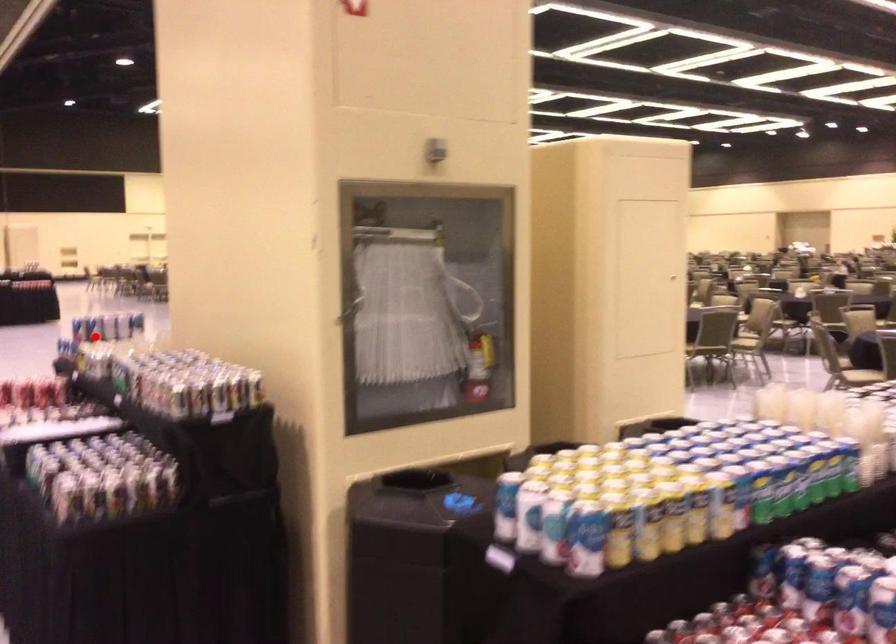
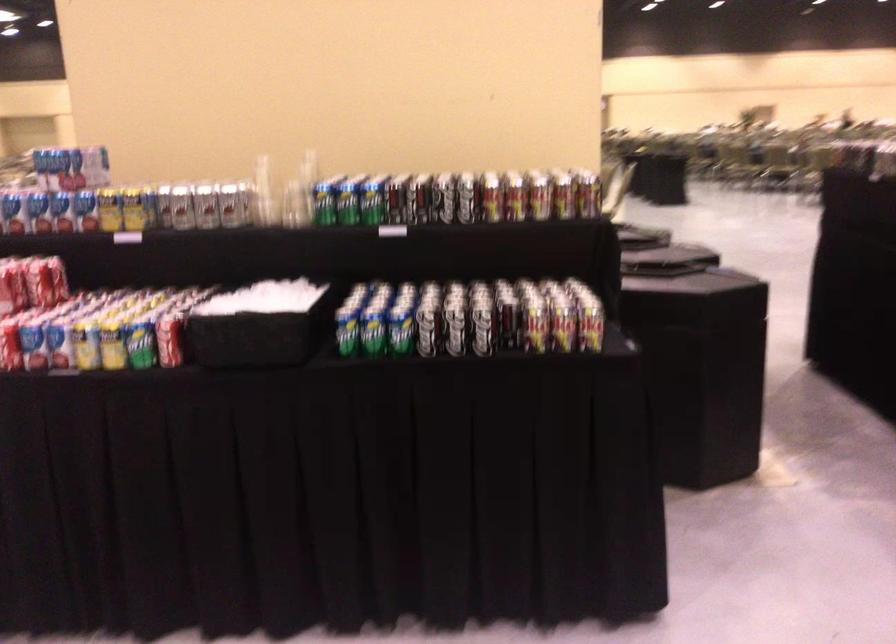
Question: A red point is marked in image1. In image2, is the corresponding 3D point closer to the camera or farther? Reply with the corresponding letter.

Choices:
 (A) The corresponding 3D point is closer.
 (B) The corresponding 3D point is farther.

Answer: (A)